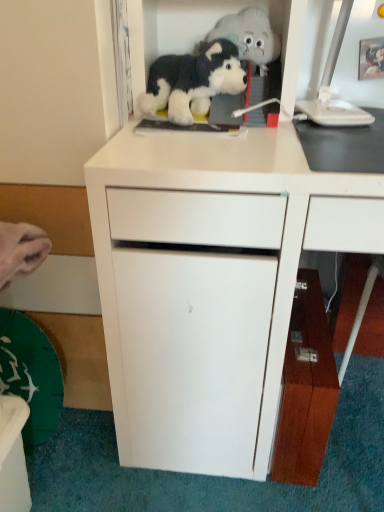
Question: Is white plastic computer monitor at upper right wider than black plush dog at upper center, the second toy positioned from the top?

Choices:
 (A) no
 (B) yes

Answer: (B)

Question: Is white plastic computer monitor at upper right oriented away from black plush dog at upper center, placed as the 1th toy when sorted from bottom to top?

Choices:
 (A) yes
 (B) no

Answer: (B)

Question: Is white plastic computer monitor at upper right facing towards black plush dog at upper center, the second toy positioned from the top?

Choices:
 (A) no
 (B) yes

Answer: (A)

Question: Is white plastic computer monitor at upper right smaller than black plush dog at upper center, the second toy positioned from the top?

Choices:
 (A) yes
 (B) no

Answer: (B)

Question: Does white plastic computer monitor at upper right have a larger size compared to black plush dog at upper center, placed as the 1th toy when sorted from bottom to top?

Choices:
 (A) no
 (B) yes

Answer: (B)

Question: Is white matte cabinet at center, the first cabinetry when ordered from left to right, to the left or to the right of white plastic computer monitor at upper right in the image?

Choices:
 (A) left
 (B) right

Answer: (A)

Question: Considering the positions of point (236, 262) and point (324, 79), is point (236, 262) closer or farther from the camera than point (324, 79)?

Choices:
 (A) closer
 (B) farther

Answer: (A)

Question: Considering the positions of white matte cabinet at center, the first cabinetry when ordered from left to right, and white plastic computer monitor at upper right in the image, is white matte cabinet at center, the first cabinetry when ordered from left to right, bigger or smaller than white plastic computer monitor at upper right?

Choices:
 (A) small
 (B) big

Answer: (B)

Question: Is white matte cabinet at center, the first cabinetry when ordered from left to right, wider or thinner than white plastic computer monitor at upper right?

Choices:
 (A) thin
 (B) wide

Answer: (B)

Question: Which is correct: wooden cabinet at lower right, the second cabinetry viewed from the left, is inside fluffy plush toy at upper center, acting as the 2th toy starting from the bottom, or outside of it?

Choices:
 (A) outside
 (B) inside

Answer: (A)

Question: Is point (319, 464) closer or farther from the camera than point (269, 70)?

Choices:
 (A) closer
 (B) farther

Answer: (B)

Question: Relative to fluffy plush toy at upper center, acting as the 2th toy starting from the bottom, is wooden cabinet at lower right, arranged as the 1th cabinetry when viewed from the right, in front or behind?

Choices:
 (A) behind
 (B) front

Answer: (B)

Question: Considering the relative positions of wooden cabinet at lower right, the second cabinetry viewed from the left, and fluffy plush toy at upper center, acting as the 2th toy starting from the bottom, in the image provided, is wooden cabinet at lower right, the second cabinetry viewed from the left, to the left or to the right of fluffy plush toy at upper center, acting as the 2th toy starting from the bottom,?

Choices:
 (A) left
 (B) right

Answer: (B)

Question: From a real-world perspective, is wooden cabinet at lower right, arranged as the 1th cabinetry when viewed from the right, physically located above or below white matte cabinet at center, which is the 2th cabinetry from right to left?

Choices:
 (A) below
 (B) above

Answer: (A)

Question: Relative to white matte cabinet at center, the first cabinetry when ordered from left to right, is wooden cabinet at lower right, arranged as the 1th cabinetry when viewed from the right, in front or behind?

Choices:
 (A) behind
 (B) front

Answer: (A)